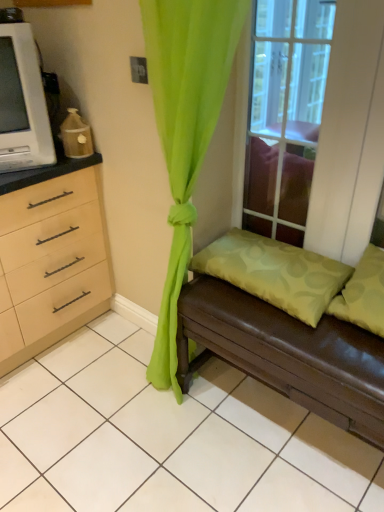
Question: Is green sheer curtain at center a part of clear glass window at upper center?

Choices:
 (A) yes
 (B) no

Answer: (B)

Question: Is clear glass window at upper center positioned beyond the bounds of green sheer curtain at center?

Choices:
 (A) yes
 (B) no

Answer: (A)

Question: Considering the relative positions of clear glass window at upper center and green sheer curtain at center in the image provided, is clear glass window at upper center behind green sheer curtain at center?

Choices:
 (A) no
 (B) yes

Answer: (B)

Question: Is clear glass window at upper center wider than green sheer curtain at center?

Choices:
 (A) no
 (B) yes

Answer: (A)

Question: Is clear glass window at upper center facing towards green sheer curtain at center?

Choices:
 (A) yes
 (B) no

Answer: (A)

Question: Is clear glass window at upper center at the left side of green sheer curtain at center?

Choices:
 (A) no
 (B) yes

Answer: (A)

Question: From the image's perspective, is brown leather studio couch at lower right on white plastic microwave at left?

Choices:
 (A) no
 (B) yes

Answer: (A)

Question: Is brown leather studio couch at lower right located outside white plastic microwave at left?

Choices:
 (A) no
 (B) yes

Answer: (B)

Question: From a real-world perspective, is brown leather studio couch at lower right on top of white plastic microwave at left?

Choices:
 (A) no
 (B) yes

Answer: (A)

Question: Is white plastic microwave at left surrounded by brown leather studio couch at lower right?

Choices:
 (A) no
 (B) yes

Answer: (A)

Question: Does brown leather studio couch at lower right have a greater height compared to white plastic microwave at left?

Choices:
 (A) no
 (B) yes

Answer: (A)

Question: Is brown leather studio couch at lower right looking in the opposite direction of white plastic microwave at left?

Choices:
 (A) no
 (B) yes

Answer: (A)

Question: Does green fabric pillow at lower right, the 2th pillow when ordered from right to left, appear on the right side of green sheer curtain at center?

Choices:
 (A) no
 (B) yes

Answer: (B)